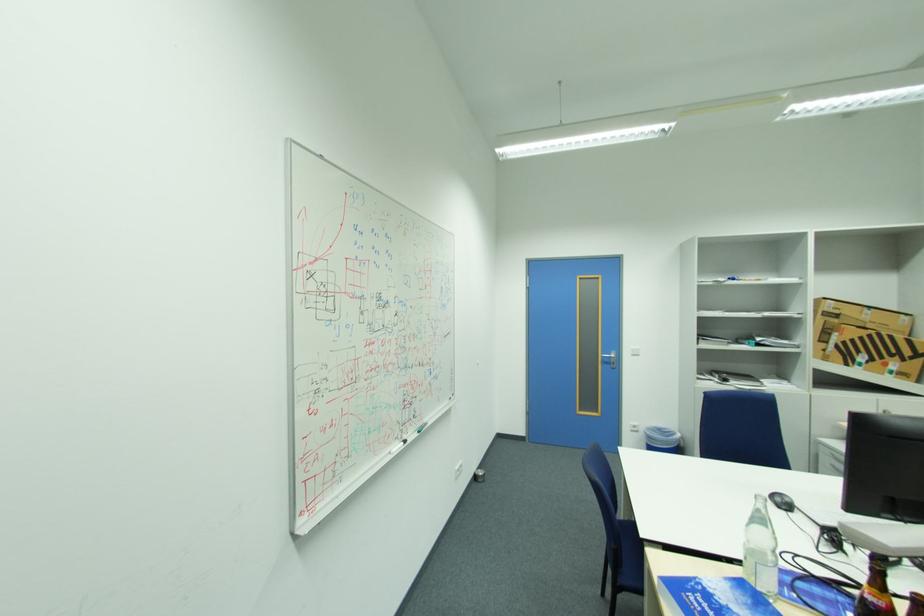
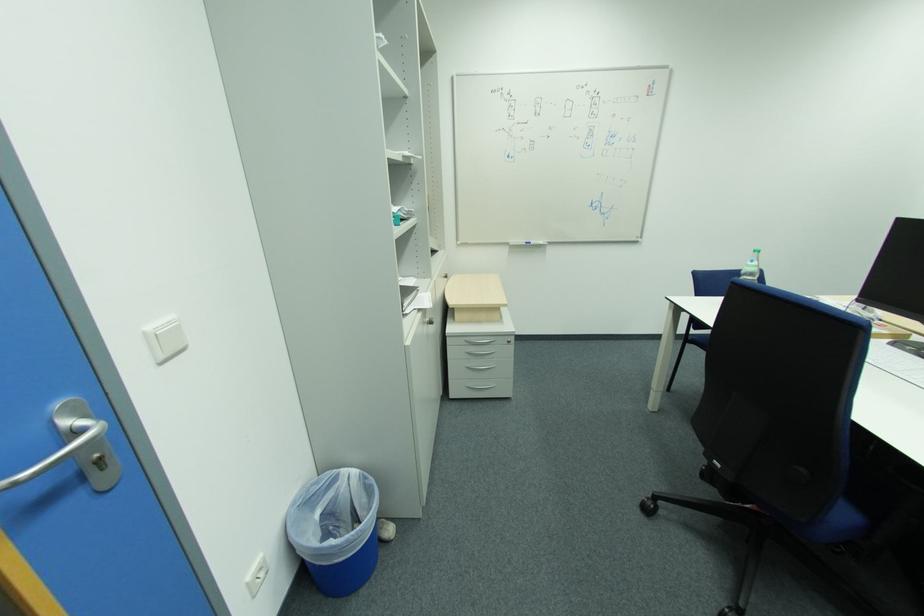
Locate, in the second image, the point that corresponds to [638,349] in the first image.

(154, 329)